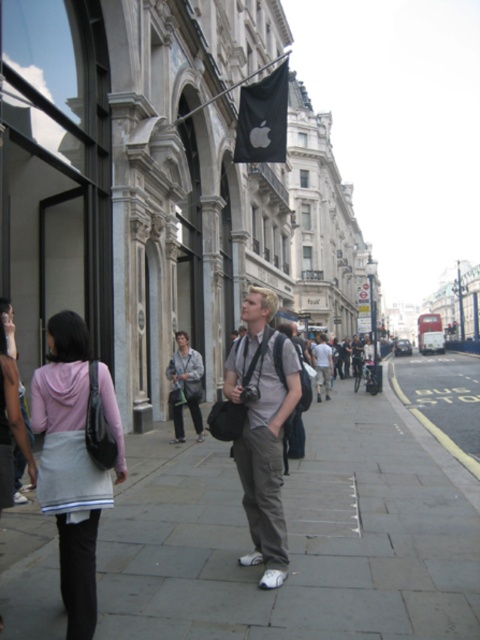
Does point (263, 140) lie behind point (180, 339)?

Yes, point (263, 140) is behind point (180, 339).

Who is higher up, black fabric flag at upper center or light gray fabric jacket at center?

black fabric flag at upper center is higher up.

What do you see at coordinates (263, 118) in the screenshot?
I see `black fabric flag at upper center` at bounding box center [263, 118].

In order to click on black fabric flag at upper center in this screenshot , I will do `click(263, 118)`.

Between light gray cotton pants at center and khaki cotton pants at center, which one appears on the right side from the viewer's perspective?

khaki cotton pants at center is more to the right.

Which is behind, point (269, 518) or point (326, 396)?

Positioned behind is point (326, 396).

This screenshot has height=640, width=480. I want to click on light gray cotton pants at center, so click(263, 429).

Does light gray cotton pants at center appear on the left side of black fabric flag at upper center?

Correct, you'll find light gray cotton pants at center to the left of black fabric flag at upper center.

In the scene shown: Who is shorter, light gray cotton pants at center or black fabric flag at upper center?

Standing shorter between the two is light gray cotton pants at center.

Between point (230, 369) and point (277, 97), which one is positioned in front?

Positioned in front is point (230, 369).

Where is `light gray cotton pants at center`? light gray cotton pants at center is located at coordinates (263, 429).